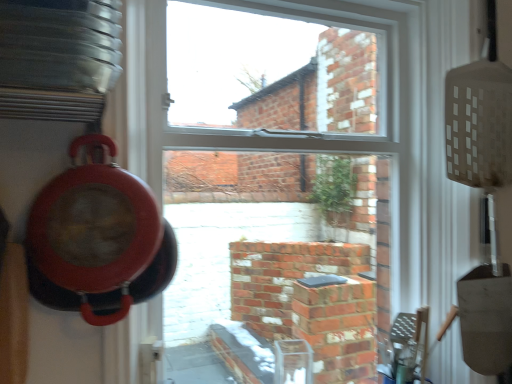
What is the approximate width of clear glass window at center?

4.06 inches.

Describe the element at coordinates (241, 131) in the screenshot. Image resolution: width=512 pixels, height=384 pixels. I see `clear glass window at center` at that location.

Identify the location of clear glass window at center. The width and height of the screenshot is (512, 384). (241, 131).

At what (x,y) coordinates should I click in order to perform the action: click on clear glass window at center. Please return your answer as a coordinate pair (x, y). This screenshot has width=512, height=384. Looking at the image, I should click on (241, 131).